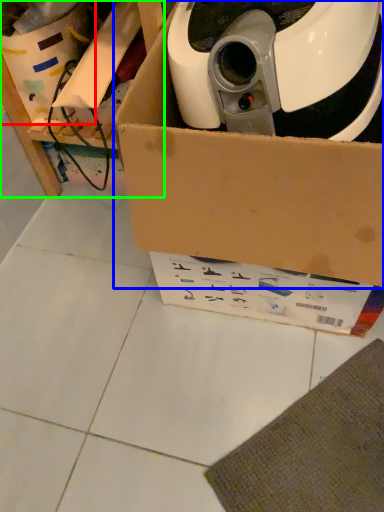
Question: Estimate the real-world distances between objects in this image. Which object is farther from storage box (highlighted by a red box), box (highlighted by a blue box) or furniture (highlighted by a green box)?

Choices:
 (A) box
 (B) furniture

Answer: (A)